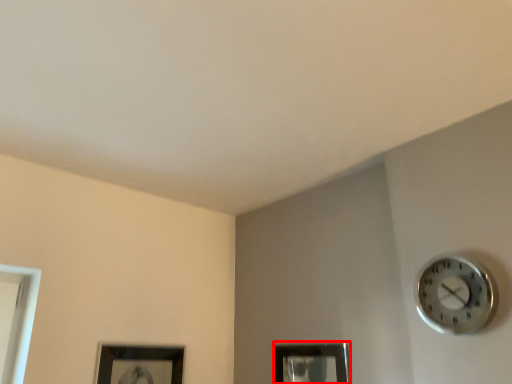
Question: From the image's perspective, where is picture frame (annotated by the red box) located relative to wall clock?

Choices:
 (A) above
 (B) below

Answer: (B)